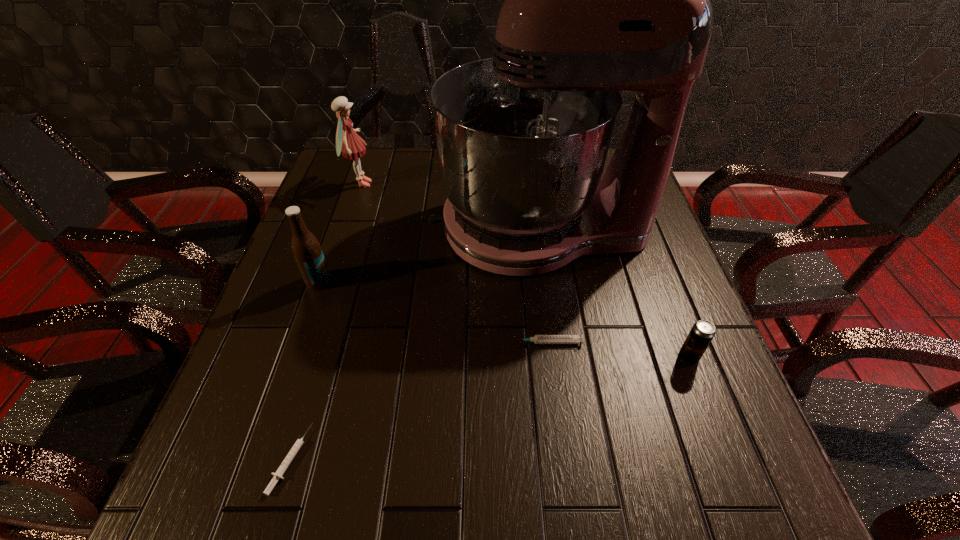
Find the location of a particular element. The image size is (960, 540). object situated at the near edge is located at coordinates (278, 474).

The image size is (960, 540). Find the location of `doll at the left edge`. doll at the left edge is located at coordinates [x=348, y=142].

You are a GUI agent. You are given a task and a screenshot of the screen. Output one action in this format:
    pyautogui.click(x=<x>, y=<y>)
    Task: Click on the beer bottle that is at the left edge
    This screenshot has width=960, height=540.
    Given the screenshot: What is the action you would take?
    pyautogui.click(x=306, y=249)

This screenshot has width=960, height=540. I want to click on syringe located in the left edge section of the desktop, so [x=278, y=474].

Locate an element on the screen. This screenshot has width=960, height=540. mixer located at the right edge is located at coordinates (598, 0).

Where is `beer can at the right edge`? This screenshot has height=540, width=960. beer can at the right edge is located at coordinates (701, 334).

This screenshot has height=540, width=960. What are the coordinates of `object located in the far left corner section of the desktop` in the screenshot? It's located at (348, 142).

Locate an element on the screen. object present at the near left corner is located at coordinates (278, 474).

Image resolution: width=960 pixels, height=540 pixels. I want to click on object positioned at the far right corner, so click(x=598, y=0).

The width and height of the screenshot is (960, 540). What are the coordinates of `free spot at the near edge of the desktop` in the screenshot? It's located at (433, 482).